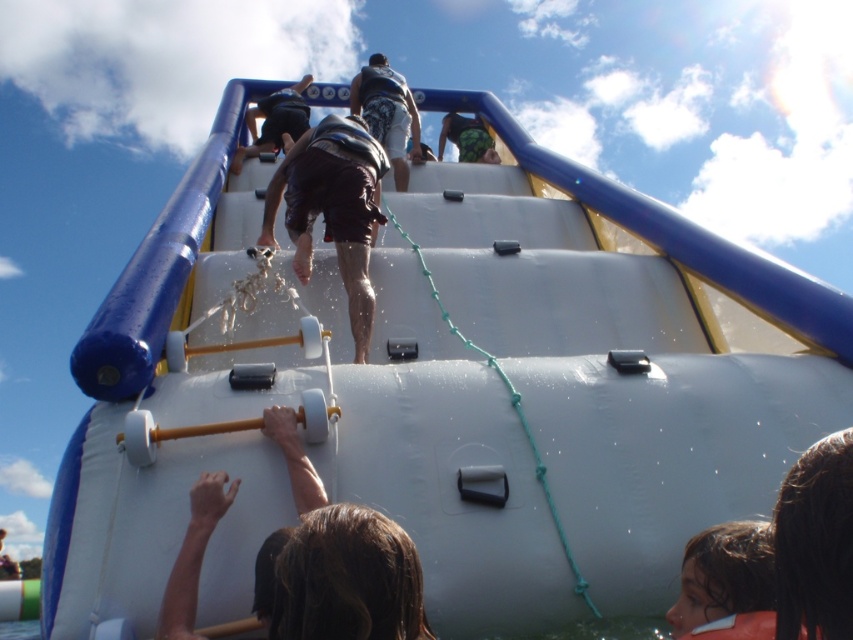
What is the position of the brown hair at lower right in the image?

The brown hair at lower right is located at point (723, 576).